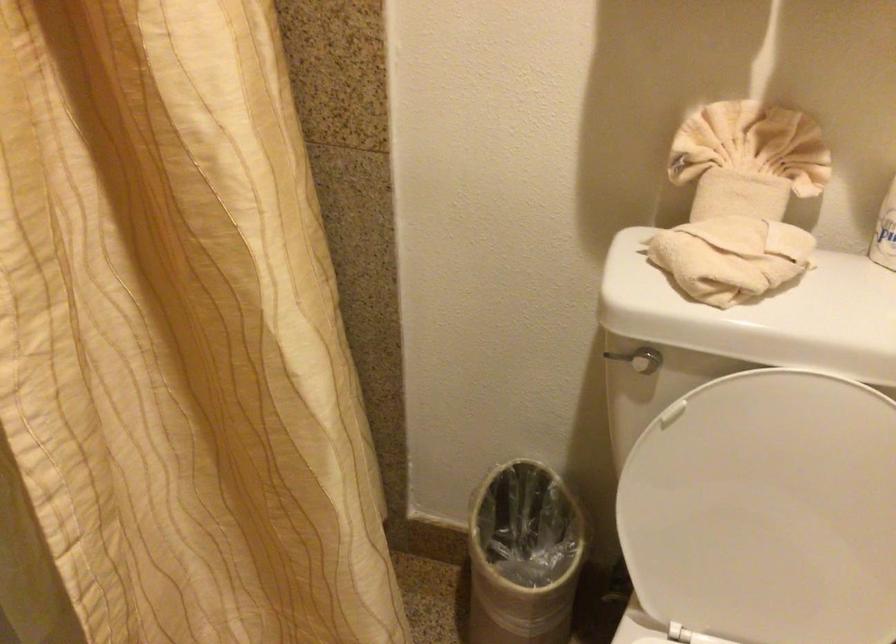
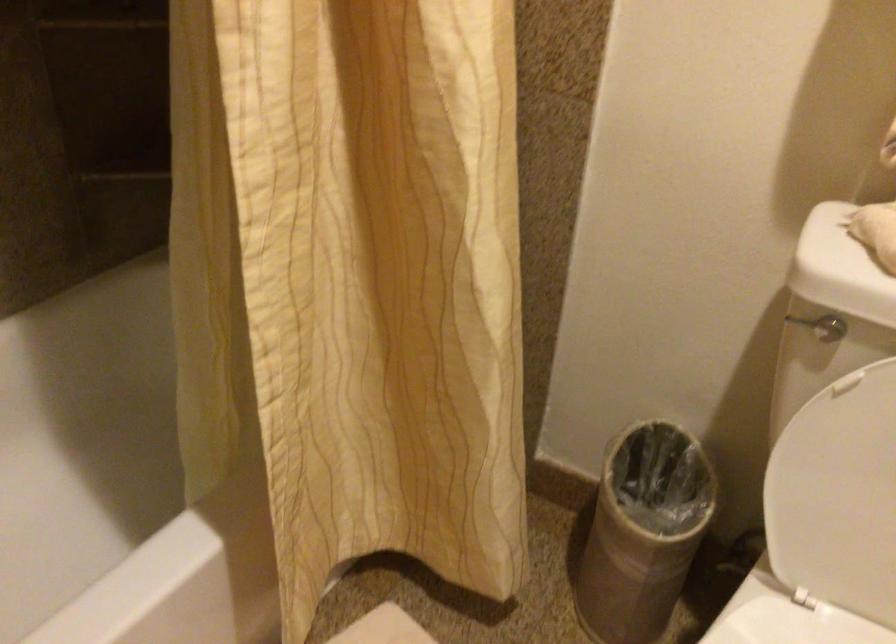
The point at (683, 509) is marked in the first image. Where is the corresponding point in the second image?

(834, 480)